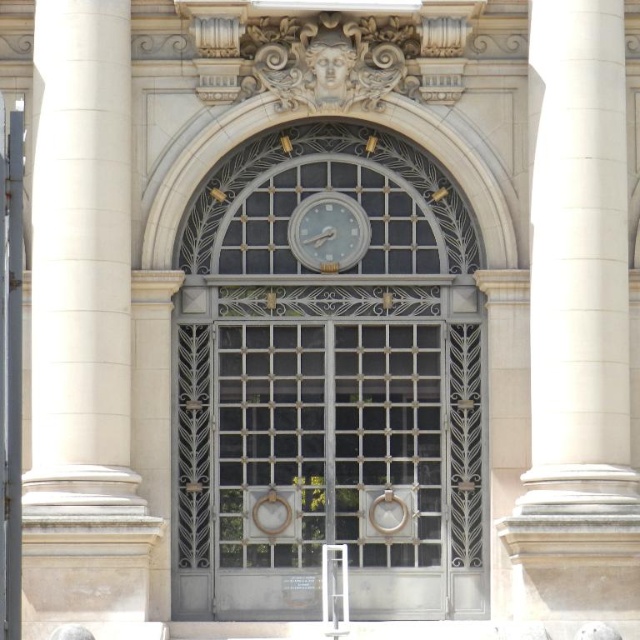
You are an architect examining the building facade. You notice the metallic gray clock at center and the white marble column at left. Which object appears closer to you in the scene?

The metallic gray clock at center appears closer because the white marble column at left is positioned behind it.

You are standing in front of the grand entrance of the building. Where is the white marble column at left located in relation to the entrance?

The white marble column at left is located at point (81, 262) relative to the entrance.

You are an architect examining the building facade. You need to install a new light fixture between the white marble column at left and the white glossy clock at upper center. Based on their positions, where should you place the light fixture to ensure it is centered between them?

The white marble column at left is to the left of the white glossy clock at upper center, so the light fixture should be placed midway between them horizontally, aligning centrally between the two objects.